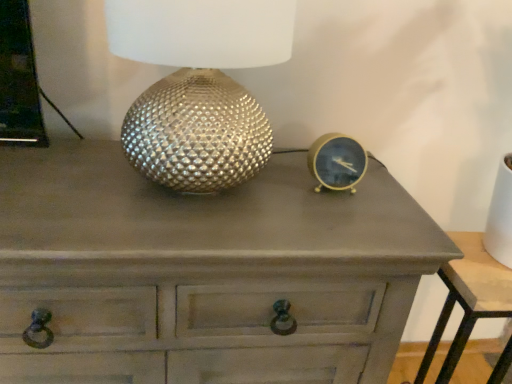
Where is `free space in front of gold metallic clock at right`? The height and width of the screenshot is (384, 512). free space in front of gold metallic clock at right is located at coordinates (334, 228).